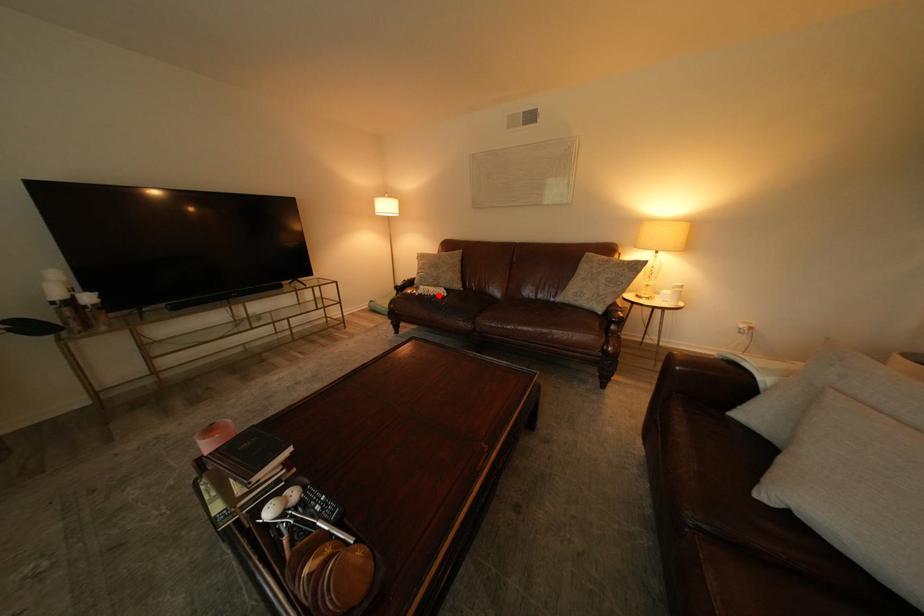
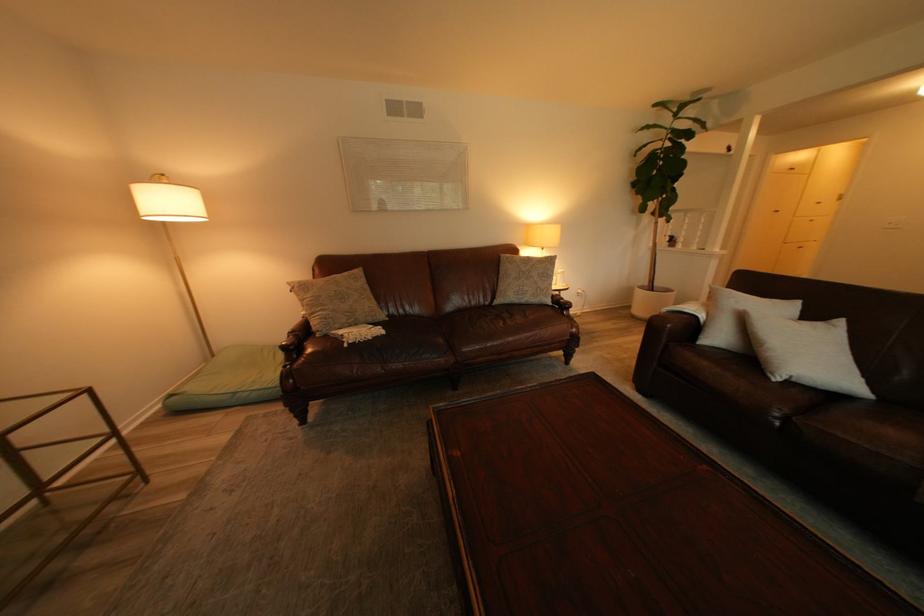
Locate, in the second image, the point that corresponds to the highlighted location in the first image.

(372, 342)